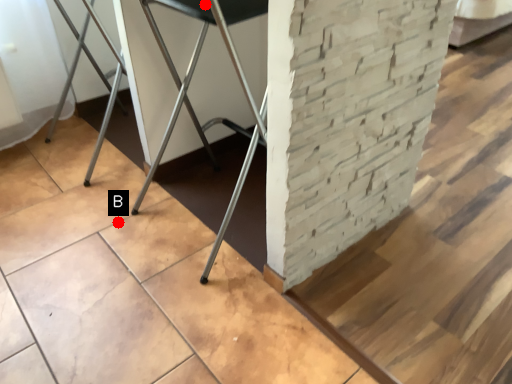
Question: Two points are circled on the image, labeled by A and B beside each circle. Which point appears closest to the camera in this image?

Choices:
 (A) A is closer
 (B) B is closer

Answer: (A)